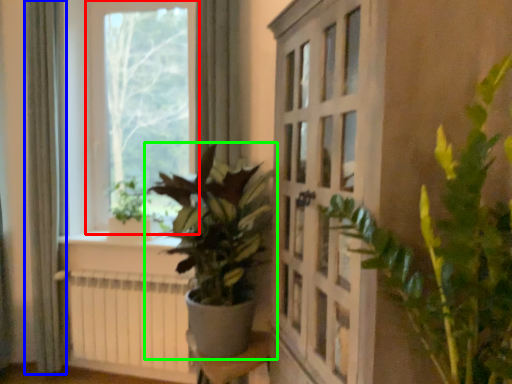
Question: Which object is positioned farthest from window (highlighted by a red box)? Select from curtain (highlighted by a blue box) and houseplant (highlighted by a green box).

Choices:
 (A) curtain
 (B) houseplant

Answer: (B)